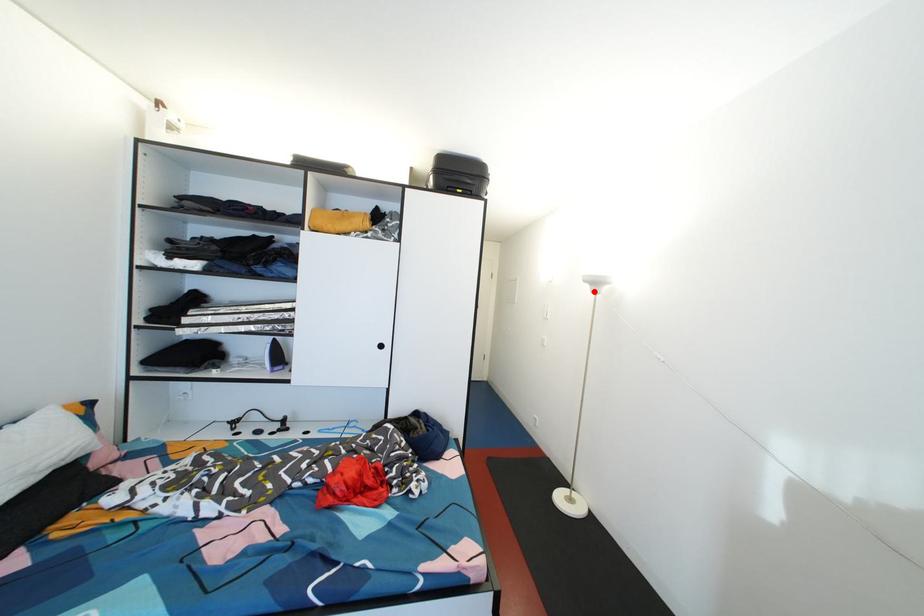
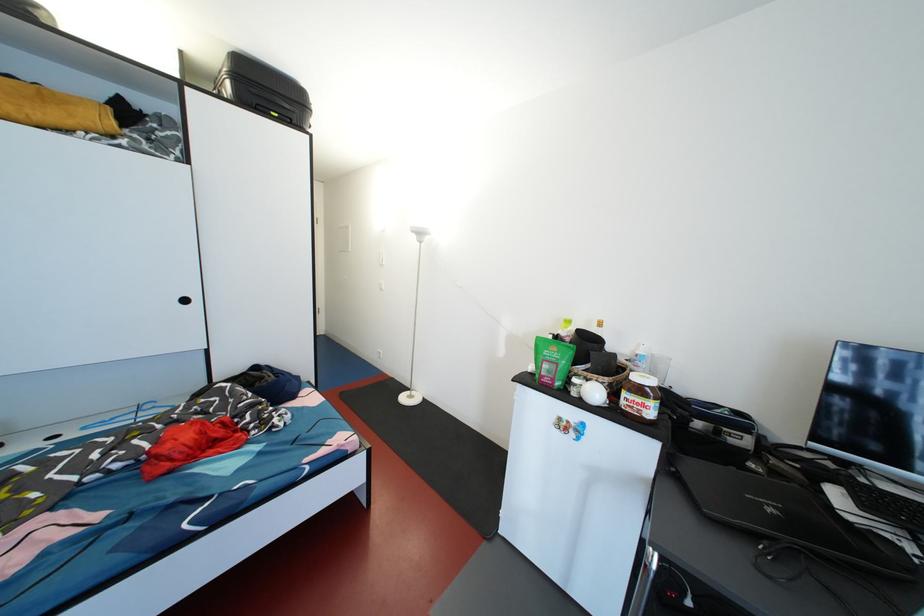
Locate, in the second image, the point that corresponds to the highlighted location in the first image.

(420, 241)